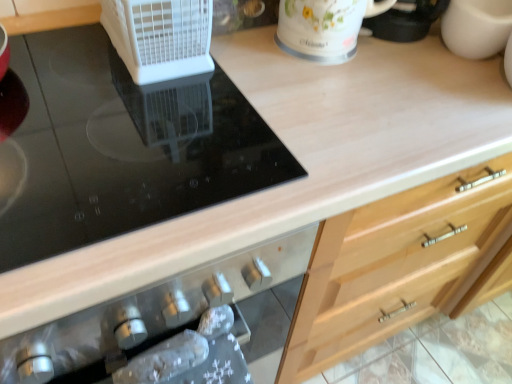
Question: Is black glass cooktop at upper left completely or partially outside of white floral mug at upper center?

Choices:
 (A) no
 (B) yes

Answer: (B)

Question: Does black glass cooktop at upper left have a greater width compared to white floral mug at upper center?

Choices:
 (A) no
 (B) yes

Answer: (B)

Question: Is black glass cooktop at upper left positioned with its back to white floral mug at upper center?

Choices:
 (A) yes
 (B) no

Answer: (B)

Question: From a real-world perspective, is black glass cooktop at upper left under white floral mug at upper center?

Choices:
 (A) yes
 (B) no

Answer: (A)

Question: Is the depth of black glass cooktop at upper left less than that of white floral mug at upper center?

Choices:
 (A) no
 (B) yes

Answer: (B)

Question: Considering the relative positions of black glass cooktop at upper left and white floral mug at upper center in the image provided, is black glass cooktop at upper left behind white floral mug at upper center?

Choices:
 (A) no
 (B) yes

Answer: (A)

Question: Is white plastic fan at upper left smaller than black glass cooktop at upper left?

Choices:
 (A) yes
 (B) no

Answer: (A)

Question: Is white plastic fan at upper left closer to camera compared to black glass cooktop at upper left?

Choices:
 (A) no
 (B) yes

Answer: (A)

Question: Could you tell me if white plastic fan at upper left is facing black glass cooktop at upper left?

Choices:
 (A) yes
 (B) no

Answer: (B)

Question: From a real-world perspective, is white plastic fan at upper left located beneath black glass cooktop at upper left?

Choices:
 (A) no
 (B) yes

Answer: (A)

Question: From the image's perspective, would you say white plastic fan at upper left is positioned over black glass cooktop at upper left?

Choices:
 (A) yes
 (B) no

Answer: (A)

Question: Is white plastic fan at upper left positioned with its back to black glass cooktop at upper left?

Choices:
 (A) no
 (B) yes

Answer: (A)

Question: From the image's perspective, is white floral mug at upper center located above black glass cooktop at upper left?

Choices:
 (A) no
 (B) yes

Answer: (B)